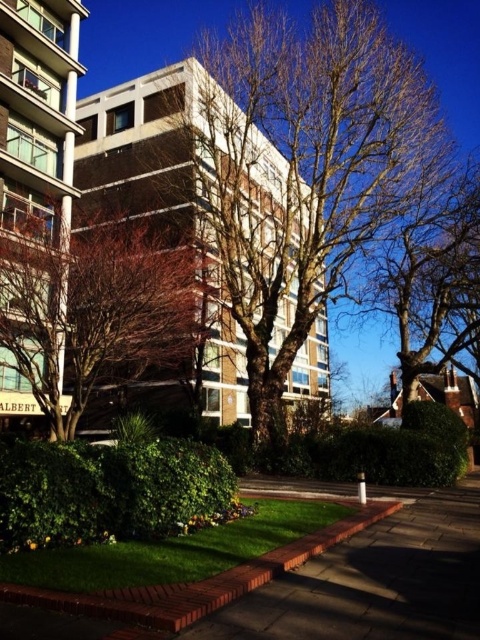
Does brown textured tree at center appear under green leafy hedge at lower left?

No, brown textured tree at center is not below green leafy hedge at lower left.

Between brown textured tree at center and green leafy hedge at lower left, which one is positioned higher?

brown textured tree at center is above.

Which is behind, point (233, 220) or point (164, 461)?

Point (233, 220)

Where is `brown textured tree at center`? This screenshot has width=480, height=640. brown textured tree at center is located at coordinates (307, 170).

Is paved stone pavement at center taller than bare branches at upper right?

Incorrect, paved stone pavement at center's height is not larger of bare branches at upper right's.

Does paved stone pavement at center appear on the left side of bare branches at upper right?

Indeed, paved stone pavement at center is positioned on the left side of bare branches at upper right.

In order to click on paved stone pavement at center in this screenshot , I will do `click(374, 580)`.

Find the location of a particular element. paved stone pavement at center is located at coordinates (374, 580).

The image size is (480, 640). What do you see at coordinates (106, 490) in the screenshot?
I see `green leafy hedge at lower left` at bounding box center [106, 490].

Does green leafy hedge at lower left have a lesser height compared to bare branches at upper right?

Yes, green leafy hedge at lower left is shorter than bare branches at upper right.

Image resolution: width=480 pixels, height=640 pixels. What are the coordinates of `green leafy hedge at lower left` in the screenshot? It's located at (106, 490).

At what (x,y) coordinates should I click in order to perform the action: click on green leafy hedge at lower left. Please return your answer as a coordinate pair (x, y). The height and width of the screenshot is (640, 480). Looking at the image, I should click on (106, 490).